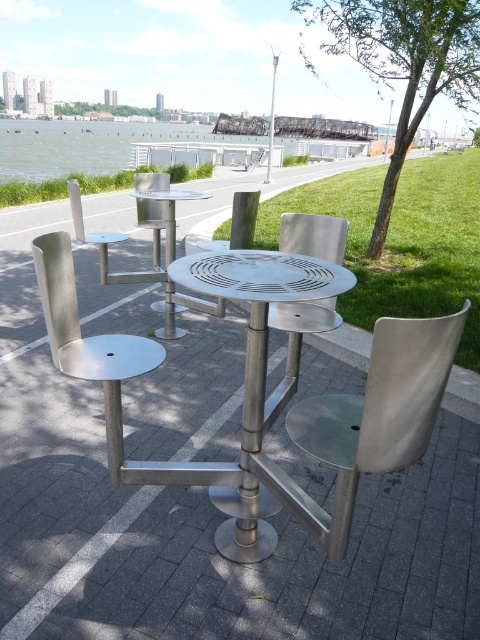
Question: Which object appears farthest from the camera in this image?

Choices:
 (A) polished stainless steel chair at center
 (B) blue water at upper left
 (C) polished metallic table at center
 (D) polished silver chair at left

Answer: (B)

Question: Which object is the farthest from the polished metallic table at center?

Choices:
 (A) polished stainless steel table at center
 (B) blue water at upper left
 (C) silver metallic pole at upper center
 (D) metallic silver chair at center

Answer: (B)

Question: Is silver metallic chair at center further to the viewer compared to silver metallic pole at upper center?

Choices:
 (A) no
 (B) yes

Answer: (A)

Question: Which point is farther to the camera?

Choices:
 (A) metallic silver chair at center
 (B) silver metallic pole at upper center

Answer: (B)

Question: Is blue water at upper left above metallic silver chair at center?

Choices:
 (A) no
 (B) yes

Answer: (B)

Question: Is blue water at upper left below silver metallic pole at upper center?

Choices:
 (A) no
 (B) yes

Answer: (A)